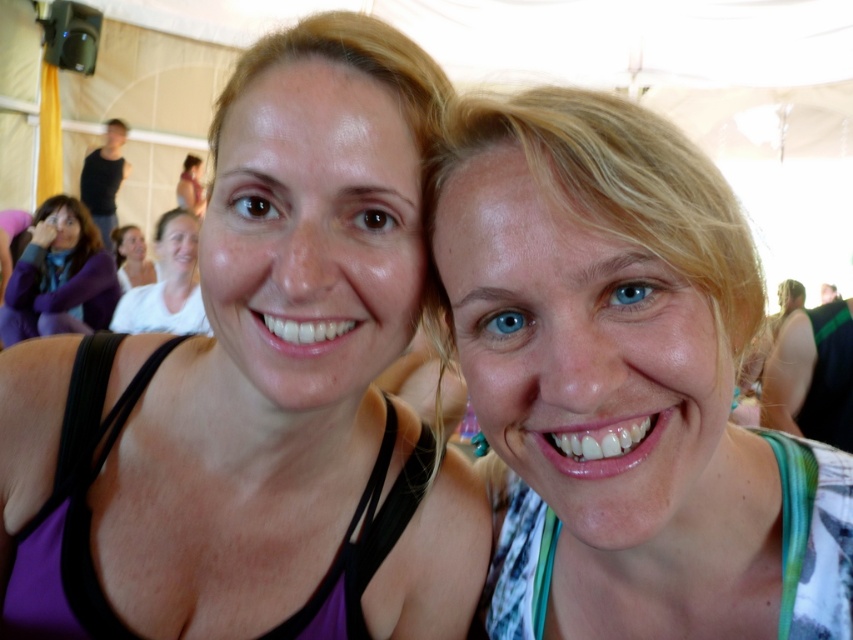
Which is above, matte white tank top at upper left or matte pink tank top at upper left?

Positioned higher is matte pink tank top at upper left.

Which is behind, point (120, 227) or point (199, 157)?

Positioned behind is point (199, 157).

Is point (144, 262) closer to viewer compared to point (177, 189)?

Yes, it is in front of point (177, 189).

The width and height of the screenshot is (853, 640). In order to click on matte white tank top at upper left in this screenshot , I will do `click(132, 257)`.

Who is positioned more to the right, matte white tank top at center or matte white tank top at upper left?

From the viewer's perspective, matte white tank top at center appears more on the right side.

Consider the image. Who is positioned more to the left, matte white tank top at center or matte white tank top at upper left?

matte white tank top at upper left

Is point (175, 284) closer to viewer compared to point (128, 280)?

Yes, it is.

Locate an element on the screen. The image size is (853, 640). matte white tank top at center is located at coordinates (167, 284).

Consider the image. Can you confirm if purple fleece jacket at left is positioned to the left of matte white tank top at upper left?

No, purple fleece jacket at left is not to the left of matte white tank top at upper left.

Does point (90, 323) come farther from viewer compared to point (111, 234)?

No, (90, 323) is closer to viewer.

At what (x,y) coordinates should I click in order to perform the action: click on purple fleece jacket at left. Please return your answer as a coordinate pair (x, y). Looking at the image, I should click on (59, 276).